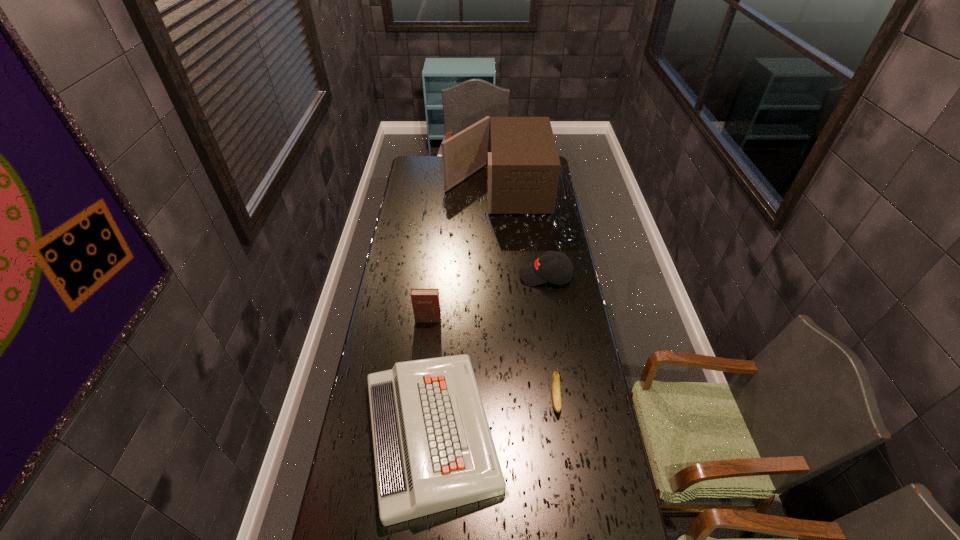
Where is `banana present at the right edge`? banana present at the right edge is located at coordinates (555, 383).

Locate an element on the screen. baseball cap that is at the right edge is located at coordinates (545, 268).

Where is `object located in the far right corner section of the desktop`? object located in the far right corner section of the desktop is located at coordinates (523, 170).

Find the location of a particular element. Image resolution: width=960 pixels, height=540 pixels. vacant space at the left edge is located at coordinates (406, 214).

In the image, there is a desktop. Where is `vacant region at the right edge`? vacant region at the right edge is located at coordinates (562, 411).

This screenshot has width=960, height=540. Find the location of `vacant space at the far left corner of the desktop`. vacant space at the far left corner of the desktop is located at coordinates (416, 171).

Find the location of `vacant region between the banana and the baseball cap`. vacant region between the banana and the baseball cap is located at coordinates (550, 338).

I want to click on vacant point located between the second farthest object and the tallest object, so click(x=520, y=231).

Find the location of a particular element. free spot between the baseball cap and the microwave oven is located at coordinates (520, 231).

Where is `vacant space in between the banana and the third farthest object`? Image resolution: width=960 pixels, height=540 pixels. vacant space in between the banana and the third farthest object is located at coordinates (492, 360).